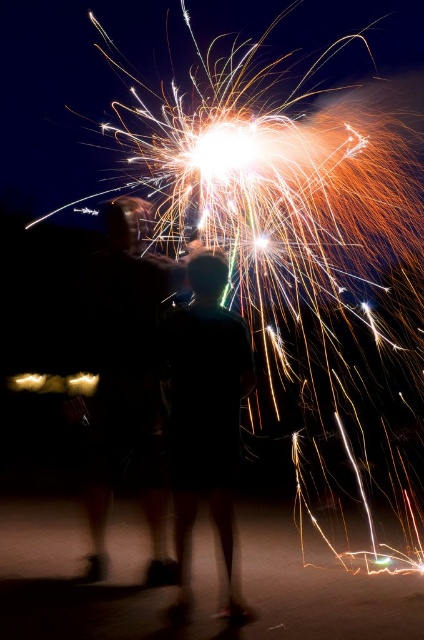
Question: Does black matte couple at center come behind black matte shirt at center?

Choices:
 (A) no
 (B) yes

Answer: (B)

Question: Which object appears farthest from the camera in this image?

Choices:
 (A) black matte couple at center
 (B) black matte shirt at center

Answer: (A)

Question: Does black matte couple at center appear under black matte shirt at center?

Choices:
 (A) no
 (B) yes

Answer: (A)

Question: Does black matte couple at center appear over black matte shirt at center?

Choices:
 (A) yes
 (B) no

Answer: (A)

Question: Which point is closer to the camera?

Choices:
 (A) (128, 259)
 (B) (206, 444)

Answer: (B)

Question: Which of the following is the closest to the observer?

Choices:
 (A) black matte couple at center
 (B) black matte shirt at center

Answer: (B)